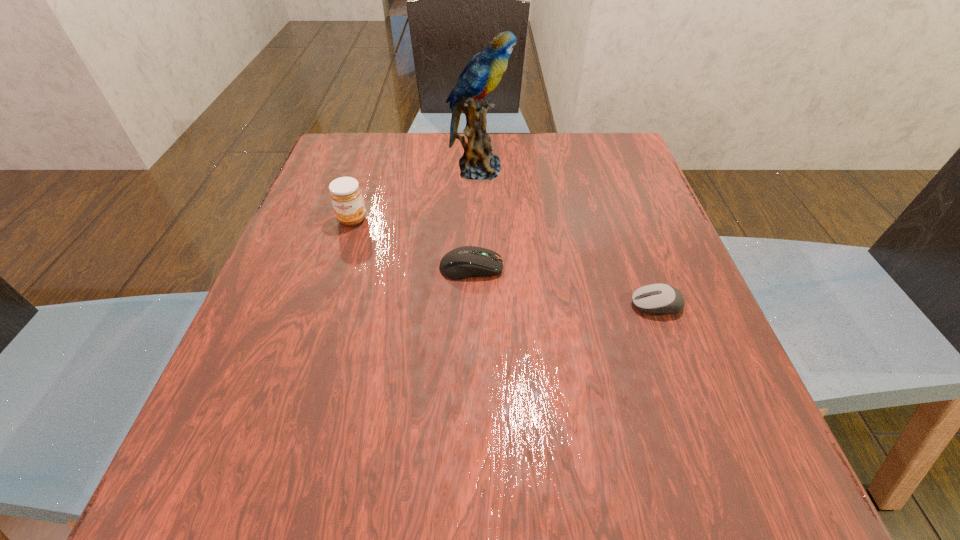
You are a GUI agent. You are given a task and a screenshot of the screen. Output one action in this format:
    pyautogui.click(x=<x>, y=<y>)
    Task: Click on the tallest object
    Image resolution: width=960 pixels, height=540 pixels.
    Given the screenshot: What is the action you would take?
    pyautogui.click(x=482, y=74)

This screenshot has width=960, height=540. I want to click on parrot, so click(482, 74).

You are a GUI agent. You are given a task and a screenshot of the screen. Output one action in this format:
    pyautogui.click(x=<x>, y=<y>)
    Task: Click on the leftmost object
    
    Given the screenshot: What is the action you would take?
    pyautogui.click(x=345, y=193)

Identify the location of the third shortest object. (345, 193).

Locate an element on the screen. the left computer equipment is located at coordinates (463, 262).

Identify the location of the third farthest object. (463, 262).

This screenshot has width=960, height=540. I want to click on the rightmost object, so click(656, 298).

Locate an element on the screen. the right computer equipment is located at coordinates click(656, 298).

This screenshot has width=960, height=540. Find the location of `vacant space situated 0.170m on the face of the tallest object`. vacant space situated 0.170m on the face of the tallest object is located at coordinates (580, 169).

At what (x,y) coordinates should I click in order to perform the action: click on vacant region located on the front label of the jam. Please return your answer as a coordinate pair (x, y). Looking at the image, I should click on (330, 289).